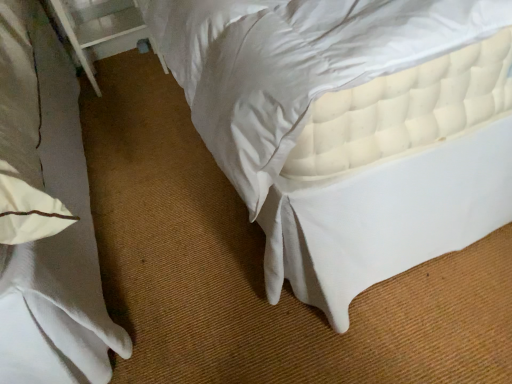
Identify the location of vacant space in front of white plastic balustrade at upper left. The image size is (512, 384). (126, 104).